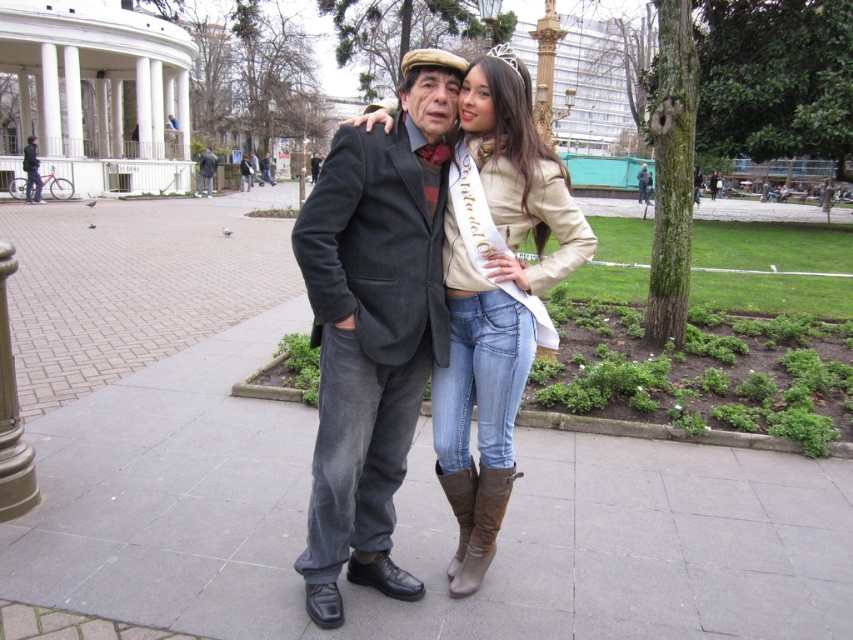
Does dark gray wool suit at center appear on the left side of dark gray suit at center?

In fact, dark gray wool suit at center is to the right of dark gray suit at center.

Based on the photo, how much distance is there between dark gray wool suit at center and dark gray suit at center?

88.86 feet

Measure the distance between dark gray wool suit at center and camera.

A distance of 2.32 meters exists between dark gray wool suit at center and camera.

Where is `dark gray wool suit at center`? This screenshot has width=853, height=640. dark gray wool suit at center is located at coordinates (373, 326).

Between dark gray wool suit at center and brushed metal bicycle at left, which one is positioned lower?

dark gray wool suit at center is below.

Who is more distant from viewer, (456, 115) or (32, 157)?

Point (32, 157)

I want to click on dark gray wool suit at center, so click(373, 326).

Can you confirm if dark gray wool suit at center is wider than brown suede boot at lower right?

Correct, the width of dark gray wool suit at center exceeds that of brown suede boot at lower right.

Is dark gray wool suit at center above brown suede boot at lower right?

Yes.

Who is more forward, [381,154] or [438,477]?

Positioned in front is point [381,154].

Identify the location of dark gray wool suit at center. Image resolution: width=853 pixels, height=640 pixels. (373, 326).